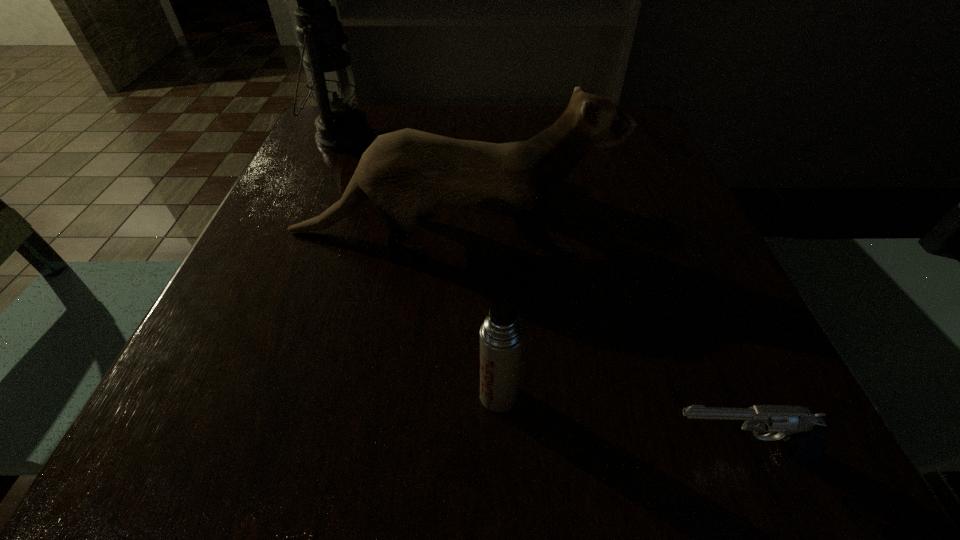
Locate an element on the screen. The width and height of the screenshot is (960, 540). free space that satisfies the following two spatial constraints: 1. on the face of the ferret; 2. on the right side of the thermos bottle is located at coordinates (438, 395).

Identify the location of free spot that satisfies the following two spatial constraints: 1. on the back side of the second shortest object; 2. on the face of the ferret. This screenshot has height=540, width=960. (493, 232).